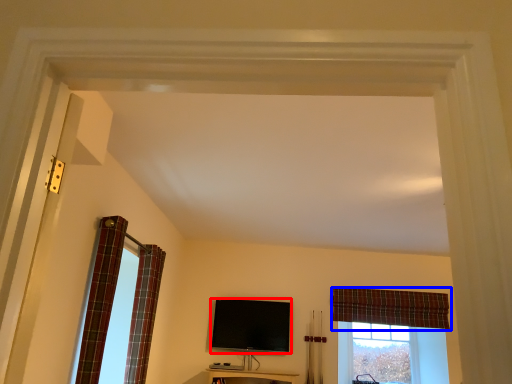
Question: Which of the following is the farthest to the observer, television (highlighted by a red box) or curtain (highlighted by a blue box)?

Choices:
 (A) television
 (B) curtain

Answer: (B)